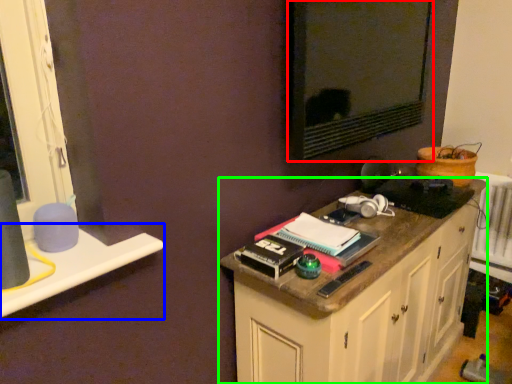
Question: Based on their relative distances, which object is farther from wide (highlighted by a red box)? Choose from window sill (highlighted by a blue box) and cabinetry (highlighted by a green box).

Choices:
 (A) window sill
 (B) cabinetry

Answer: (A)